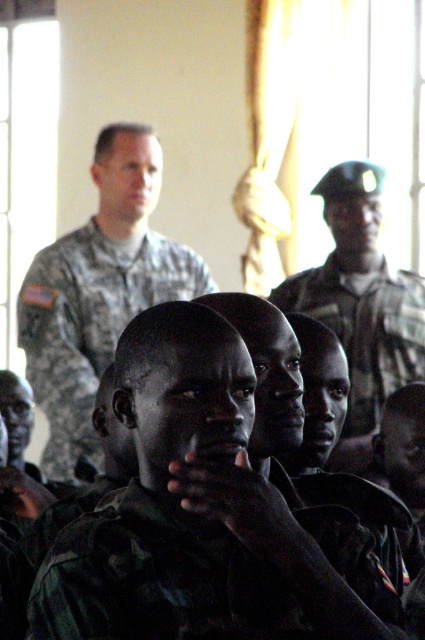
Consider the image. You are standing in the room where the military personnel are gathered. You want to move to the point at coordinates point (x=217, y=563). Considering the room layout described, is this point likely within the same room or outside of it?

The point at coordinates point (x=217, y=563) is 22.47 meters away from the viewer, which suggests it is likely outside the room since the distance is quite large for an indoor setting.

You are standing in the room and want to move from point A to point B. Point A is at coordinates point [251,595] and point B is at coordinates point [351,349]. Which point is closer to you?

Point A is closer to you because it is in front of point B.